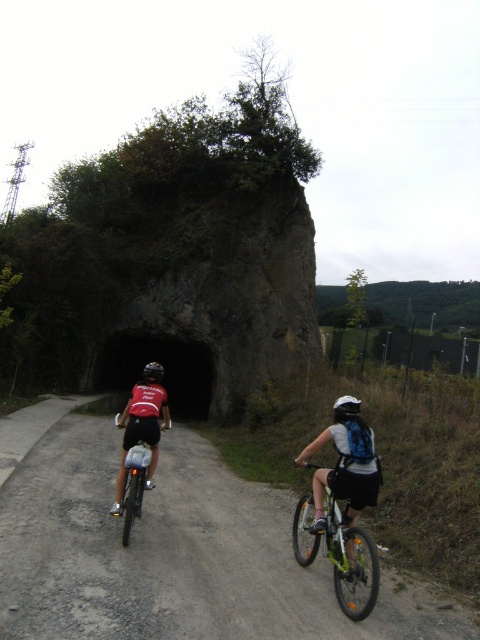
Does dirt/gravel road at center appear on the left side of black stone tunnel at center?

Incorrect, dirt/gravel road at center is not on the left side of black stone tunnel at center.

Is the position of dirt/gravel road at center more distant than that of black stone tunnel at center?

No, dirt/gravel road at center is closer to the viewer.

Is point (265, 573) more distant than point (149, 342)?

No, (265, 573) is closer to viewer.

I want to click on dirt/gravel road at center, so click(x=173, y=552).

Does black stone tunnel at center appear on the left side of green matte bicycle at right?

Yes, black stone tunnel at center is to the left of green matte bicycle at right.

Does black stone tunnel at center have a lesser height compared to green matte bicycle at right?

Incorrect, black stone tunnel at center's height does not fall short of green matte bicycle at right's.

Consider the image. Measure the distance between black stone tunnel at center and camera.

black stone tunnel at center and camera are 20.81 meters apart.

The image size is (480, 640). Identify the location of black stone tunnel at center. (162, 364).

Which is more to the right, black stone tunnel at center or white matte bicycle helmet at center?

white matte bicycle helmet at center is more to the right.

Is black stone tunnel at center smaller than white matte bicycle helmet at center?

No, black stone tunnel at center is not smaller than white matte bicycle helmet at center.

Identify the location of black stone tunnel at center. The width and height of the screenshot is (480, 640). (162, 364).